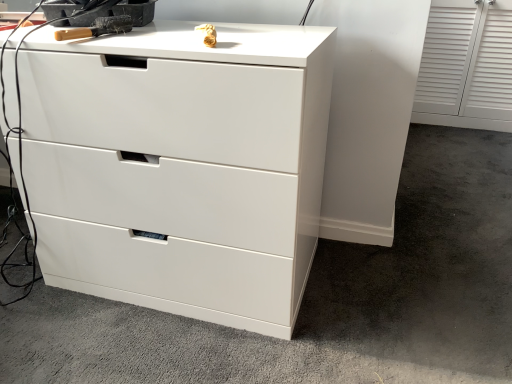
I want to click on free point to the right of white glossy chest of drawers at center, so click(392, 290).